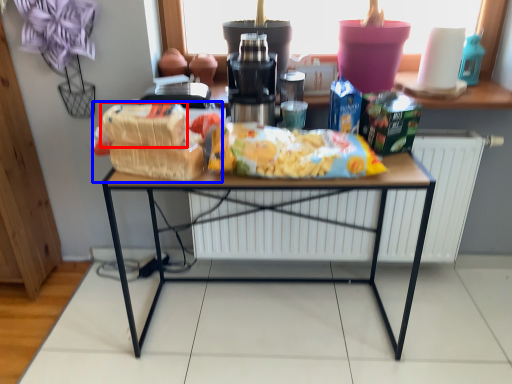
Question: Which point is closer to the camera, cereal (highlighted by a red box) or snack (highlighted by a blue box)?

Choices:
 (A) cereal
 (B) snack

Answer: (A)